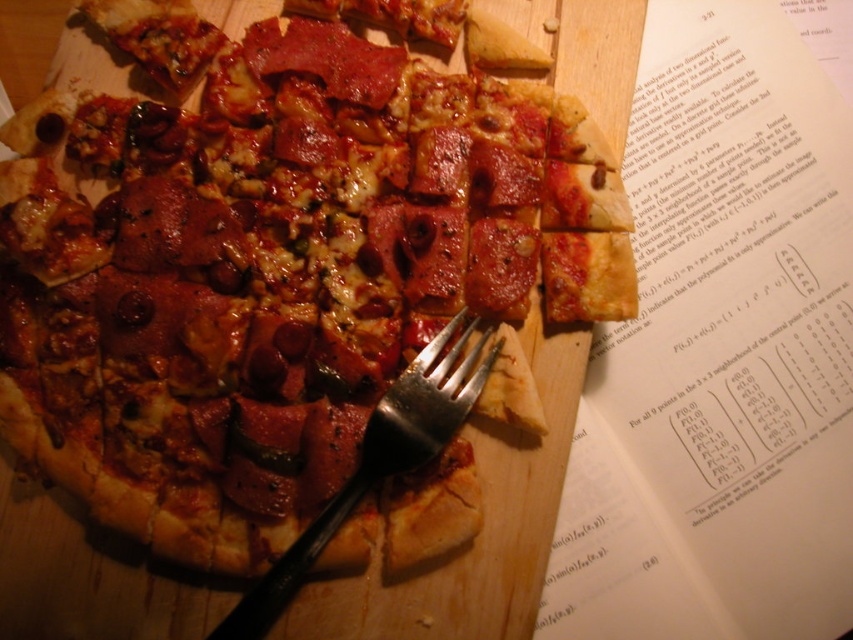
Question: Based on their relative distances, which object is nearer to the matte pizza slice at upper right?

Choices:
 (A) silver metallic fork at center
 (B) matte pepperoni pizza at center

Answer: (B)

Question: Estimate the real-world distances between objects in this image. Which object is farther from the matte pizza slice at upper right?

Choices:
 (A) matte pepperoni pizza at center
 (B) silver metallic fork at center

Answer: (B)

Question: Does matte pepperoni pizza at center appear on the right side of silver metallic fork at center?

Choices:
 (A) yes
 (B) no

Answer: (B)

Question: Is matte pizza slice at upper right positioned before silver metallic fork at center?

Choices:
 (A) no
 (B) yes

Answer: (A)

Question: Which of these objects is positioned closest to the matte pizza slice at upper right?

Choices:
 (A) matte pepperoni pizza at center
 (B) silver metallic fork at center

Answer: (A)

Question: Does matte pizza slice at upper right appear under silver metallic fork at center?

Choices:
 (A) no
 (B) yes

Answer: (A)